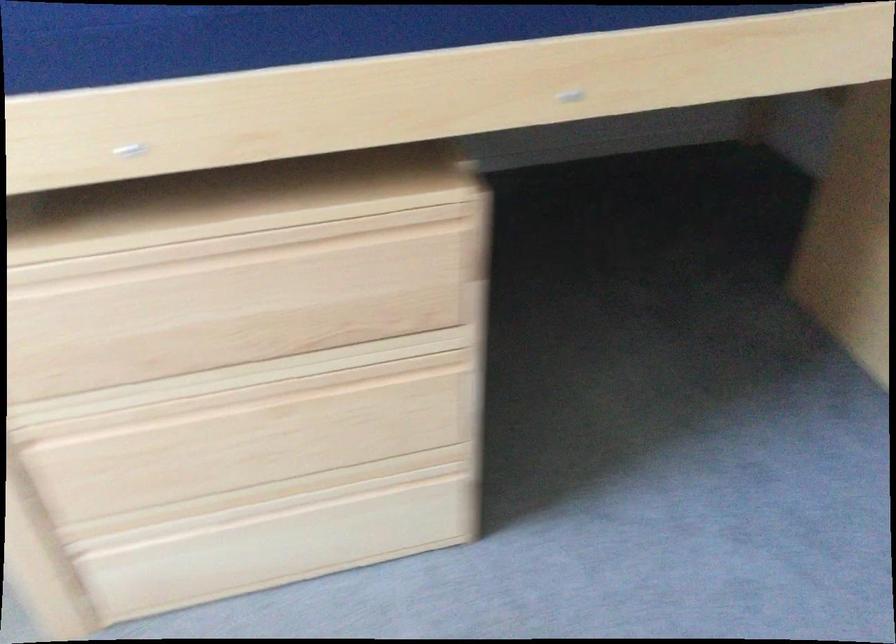
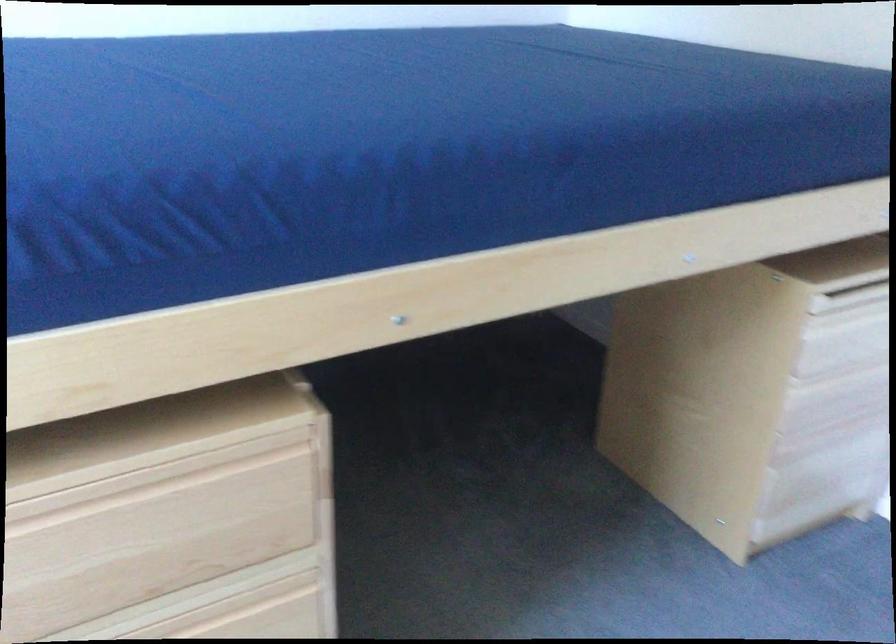
In the second image, find the point that corresponds to point (336, 256) in the first image.

(174, 494)